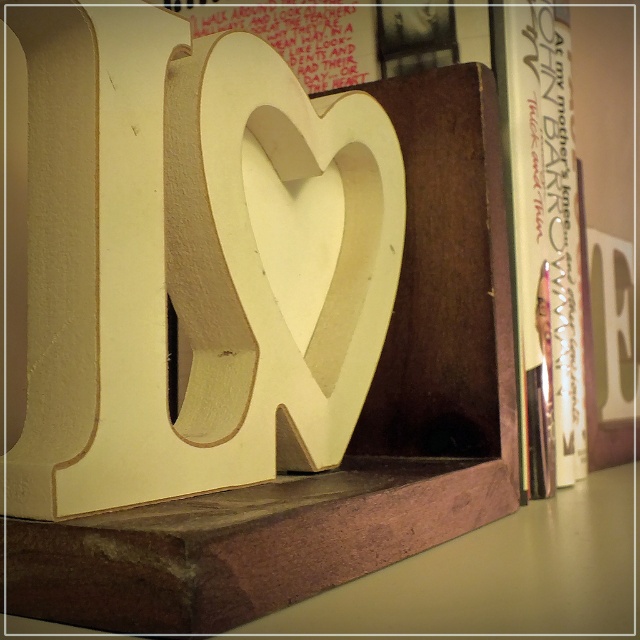
From the picture: You are organizing a shelf and need to place a 12 inch wide decorative item between the white matte wood heart at center and the white paper book at right. Can you fit it there?

The distance between the white matte wood heart at center and the white paper book at right is 13.24 inches. Since the decorative item is 12 inches wide, it can fit in the space between them.